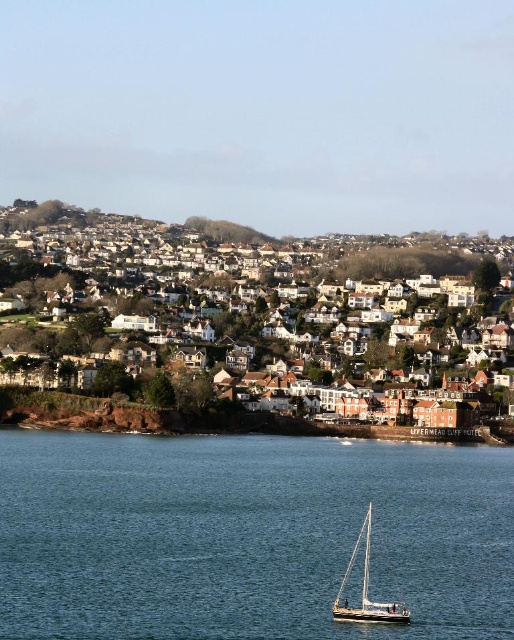
Consider the image. You are standing at the top of the hill overlooking the coastal town. You notice the blue water at lower center and the white textured houses at center. Which of these two elements appears narrower in the scene?

The blue water at lower center appears narrower than the white textured houses at center in the scene.

You are standing at the point with coordinates 0.5, 0.4 in the coastal town. Which object from the list is nearest to your current location? List the object exactly as given. The objects are white textured houses at center.

The white textured houses at center are located at point (211, 317), which is closest to your current position at (205, 320). Therefore, the nearest object is the white textured houses at center.

You are a tourist standing on the waterfront looking towards the town. You notice the white textured houses at center and the white matte sailboat at center. Which one appears larger in size?

The white textured houses at center is bigger than the white matte sailboat at center, so the white textured houses at center appears larger in size.